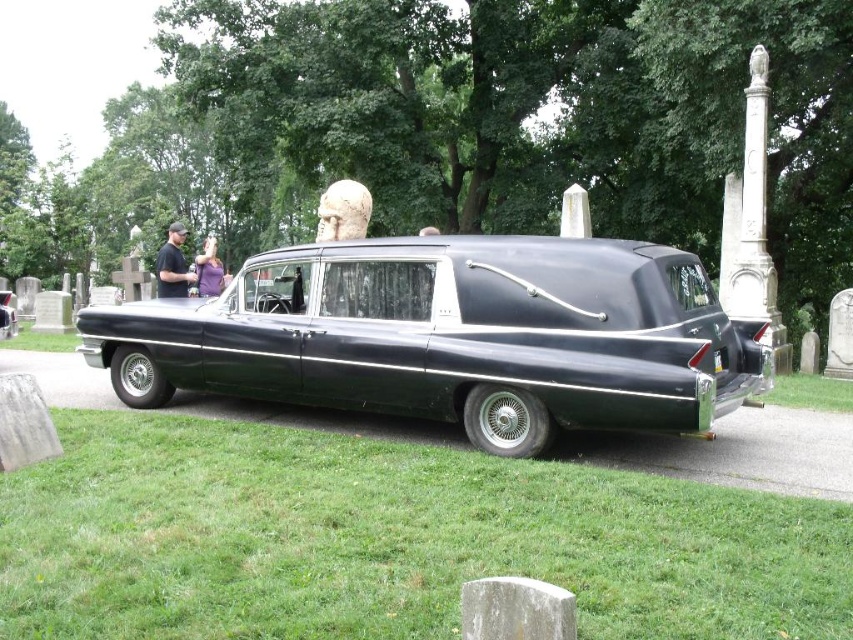
Question: Which of these objects is positioned farthest from the purple fabric at center?

Choices:
 (A) black leather jacket at center
 (B) shiny black hearse at center
 (C) glossy black hearse at center

Answer: (C)

Question: Among these points, which one is nearest to the camera?

Choices:
 (A) (161, 289)
 (B) (0, 316)
 (C) (466, 349)

Answer: (C)

Question: Does glossy black hearse at center appear under shiny black hearse at center?

Choices:
 (A) no
 (B) yes

Answer: (B)

Question: Can you confirm if glossy black hearse at center is thinner than shiny black hearse at center?

Choices:
 (A) yes
 (B) no

Answer: (B)

Question: Estimate the real-world distances between objects in this image. Which object is closer to the shiny black hearse at center?

Choices:
 (A) glossy black hearse at center
 (B) purple fabric at center
 (C) black leather jacket at center

Answer: (C)

Question: Is black leather jacket at center below purple fabric at center?

Choices:
 (A) yes
 (B) no

Answer: (A)